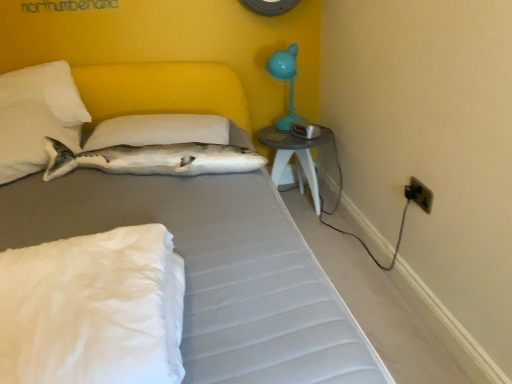
Where is `free space above matte gray table at right (from a real-world perspective)`? free space above matte gray table at right (from a real-world perspective) is located at coordinates (292, 126).